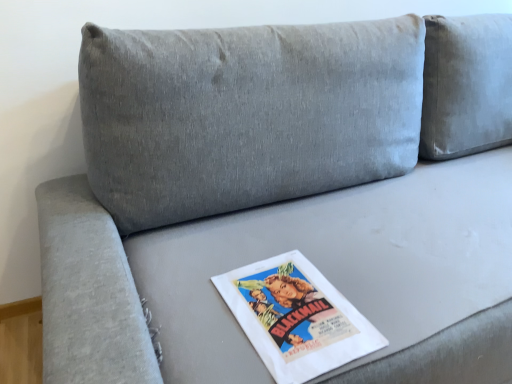
Image resolution: width=512 pixels, height=384 pixels. Identify the location of blank space situated above vintage paper at center (from a real-world perspective). (293, 305).